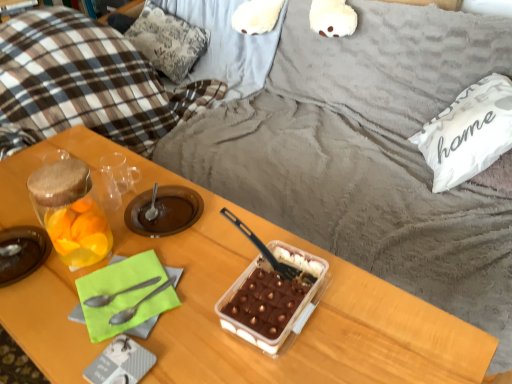
Find the location of `free spot in front of translucent glass jar at left`. free spot in front of translucent glass jar at left is located at coordinates (30, 309).